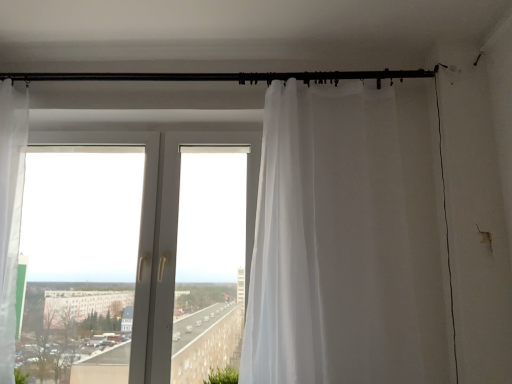
Question: From the image's perspective, is black metal rod at upper center above or below sheer white curtain at right?

Choices:
 (A) above
 (B) below

Answer: (A)

Question: Looking at the image, does black metal rod at upper center seem bigger or smaller compared to sheer white curtain at right?

Choices:
 (A) big
 (B) small

Answer: (B)

Question: Considering the real-world distances, which object is farthest from the black metal rod at upper center?

Choices:
 (A) transparent plastic window at center
 (B) green leafy plant at lower left
 (C) sheer white curtain at right

Answer: (B)

Question: Which object is positioned closest to the transparent plastic window at center?

Choices:
 (A) sheer white curtain at right
 (B) black metal rod at upper center
 (C) green leafy plant at lower left

Answer: (A)